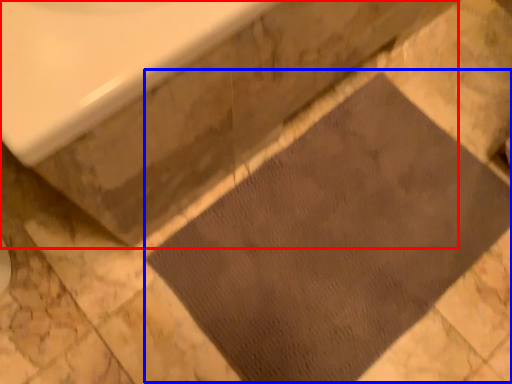
Question: Which point is further to the camera, bath (highlighted by a red box) or doormat (highlighted by a blue box)?

Choices:
 (A) bath
 (B) doormat

Answer: (B)